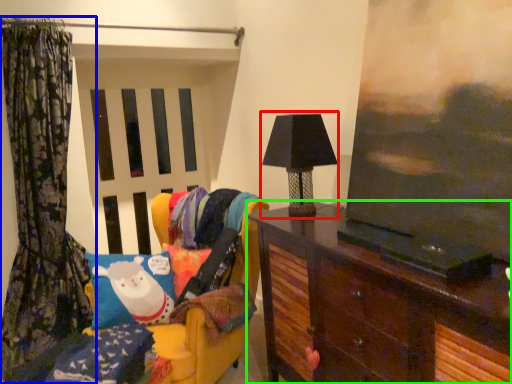
Question: Based on their relative distances, which object is nearer to table lamp (highlighted by a red box)? Choose from curtain (highlighted by a blue box) and furniture (highlighted by a green box).

Choices:
 (A) curtain
 (B) furniture

Answer: (B)